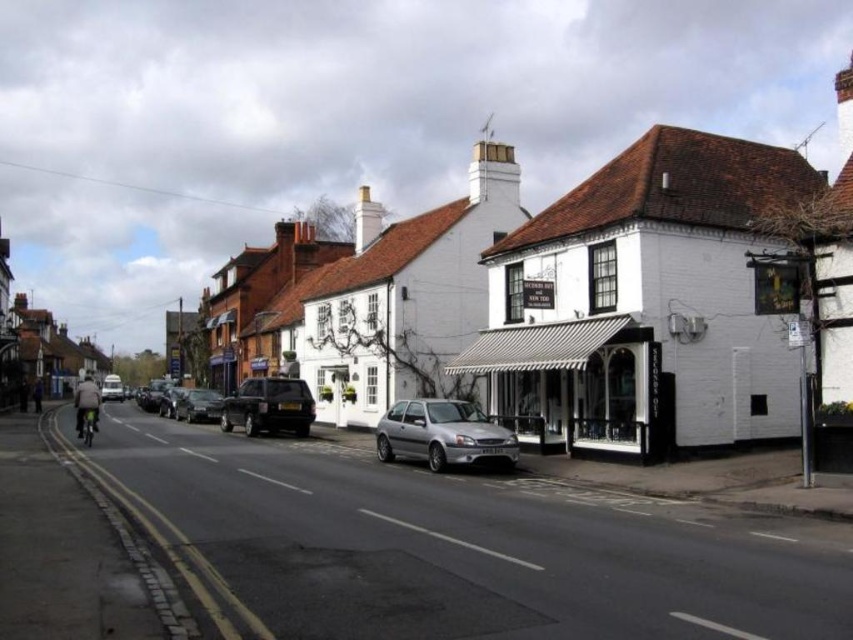
Question: From the image, what is the correct spatial relationship of silver metallic hatchback at center in relation to metallic silver car at center-left?

Choices:
 (A) above
 (B) below

Answer: (A)

Question: Which object is positioned farthest from the white painted building at right?

Choices:
 (A) silver metallic car at left
 (B) silver metallic hatchback at center

Answer: (A)

Question: Is white striped awning at center below silver metallic car at center?

Choices:
 (A) yes
 (B) no

Answer: (B)

Question: Which point is closer to the camera?

Choices:
 (A) white striped awning at center
 (B) metallic silver car at center-left

Answer: (A)

Question: Is silver metallic car at center wider than metallic silver car at center-left?

Choices:
 (A) yes
 (B) no

Answer: (B)

Question: Which object appears farthest from the camera in this image?

Choices:
 (A) silver metallic car at left
 (B) white striped awning at center

Answer: (A)